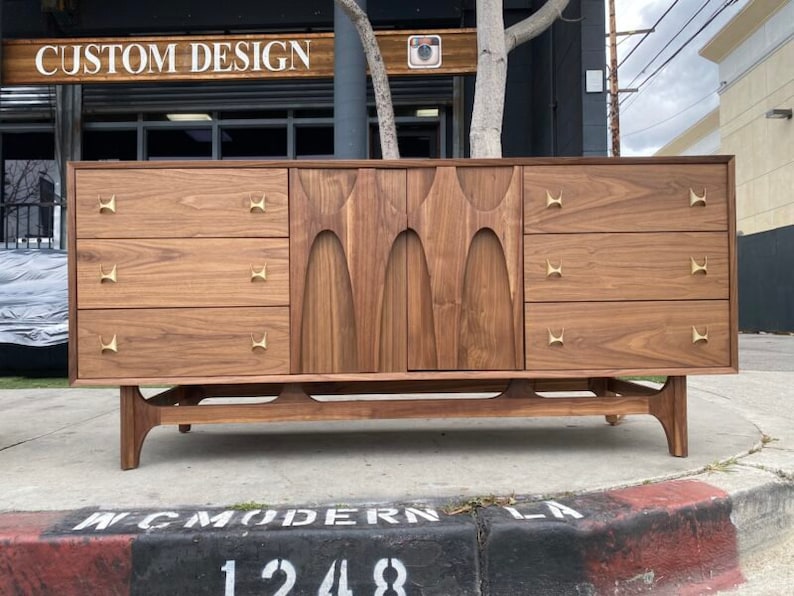
Locate an element on the screen. gold or brass drawer handles/knobs is located at coordinates (256, 341), (101, 274), (261, 201), (560, 198), (553, 268), (550, 341).